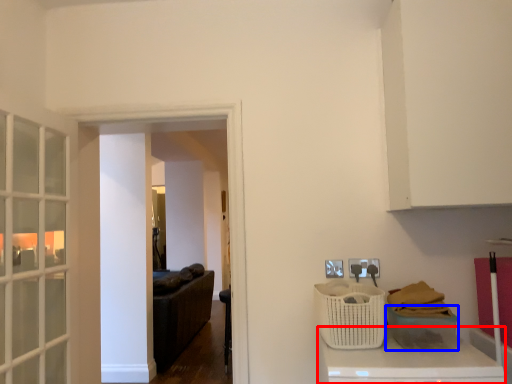
Question: Which of the following is the closest to the observer, counter top (highlighted by a red box) or basket (highlighted by a blue box)?

Choices:
 (A) counter top
 (B) basket

Answer: (A)